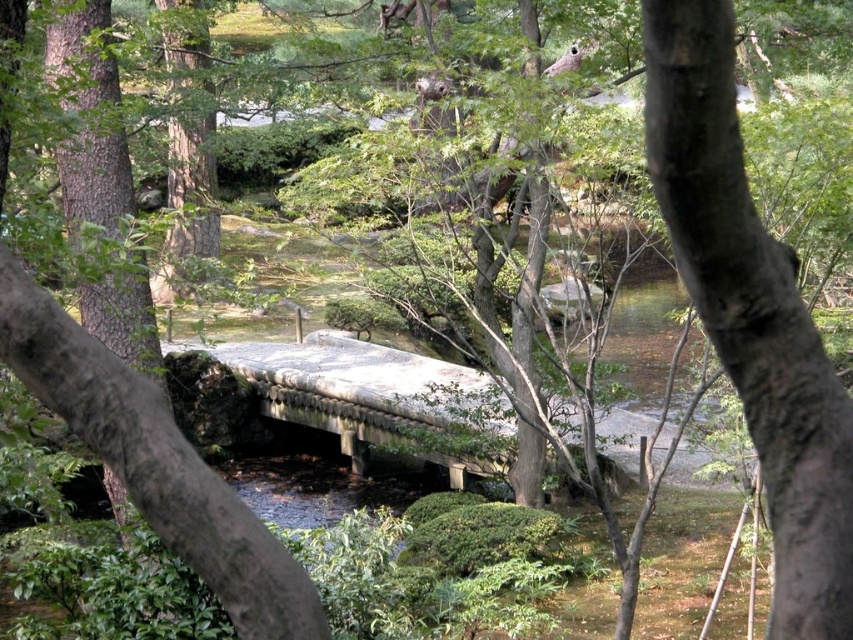
Question: Which object is farther from the camera taking this photo?

Choices:
 (A) smooth brown bark at center
 (B) stone bridge at center

Answer: (B)

Question: Does smooth brown bark at center appear on the left side of stone bridge at center?

Choices:
 (A) yes
 (B) no

Answer: (A)

Question: Is smooth brown bark at center closer to the viewer compared to stone bridge at center?

Choices:
 (A) no
 (B) yes

Answer: (B)

Question: Can you confirm if smooth brown bark at center is bigger than stone bridge at center?

Choices:
 (A) yes
 (B) no

Answer: (B)